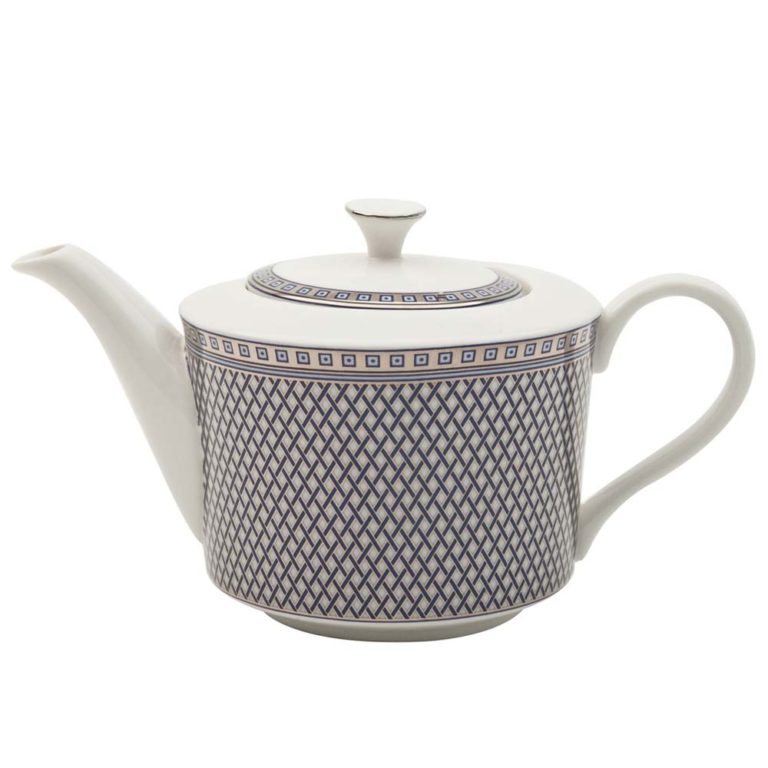
I want to click on lid handle, so click(x=384, y=210).